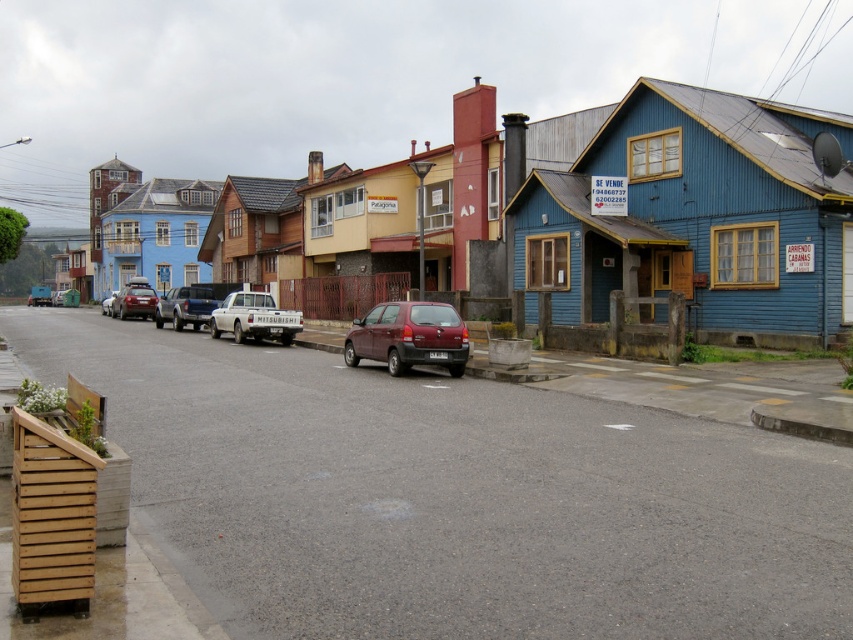
Describe the element at coordinates (254, 317) in the screenshot. The image size is (853, 640). I see `white matte pickup truck at center` at that location.

Does white matte pickup truck at center come in front of matte red car at center?

Yes, white matte pickup truck at center is closer to the viewer.

The image size is (853, 640). Identify the location of white matte pickup truck at center. (254, 317).

Locate an element on the screen. white matte pickup truck at center is located at coordinates (254, 317).

Can you confirm if maroon matte hatchback at center is positioned to the right of metallic silver sedan at center?

Correct, you'll find maroon matte hatchback at center to the right of metallic silver sedan at center.

Where is `maroon matte hatchback at center`? The width and height of the screenshot is (853, 640). maroon matte hatchback at center is located at coordinates (409, 337).

Can you confirm if matte red car at center is bigger than metallic silver sedan at center?

No.

Is point (123, 316) less distant than point (102, 308)?

Yes, it is.

Locate an element on the screen. The image size is (853, 640). matte red car at center is located at coordinates (134, 301).